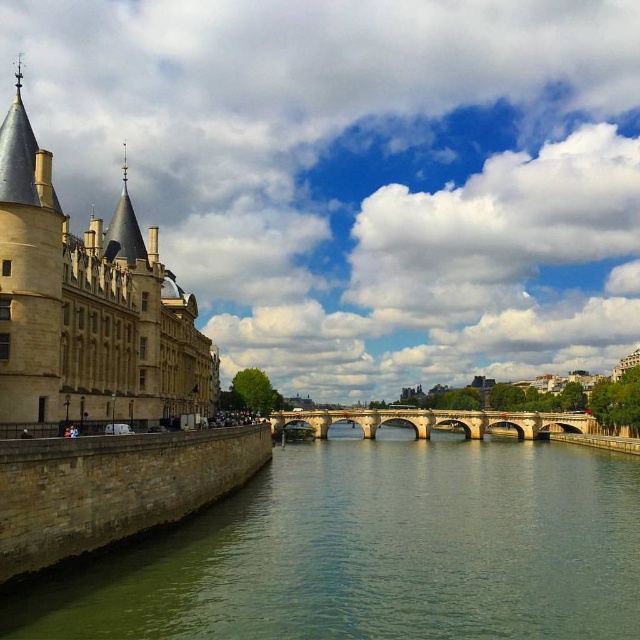
Between green stone river at center and beige stone castle at left, which one is positioned lower?

green stone river at center is lower down.

Measure the distance from green stone river at center to beige stone castle at left.

green stone river at center is 35.99 meters away from beige stone castle at left.

Measure the distance between green stone river at center and camera.

green stone river at center and camera are 56.31 meters apart.

This screenshot has height=640, width=640. I want to click on green stone river at center, so click(372, 550).

Who is taller, green stone river at center or stone bridge at center?

Standing taller between the two is green stone river at center.

Identify the location of green stone river at center. This screenshot has height=640, width=640. (372, 550).

Does beige stone castle at left have a smaller size compared to stone bridge at center?

No, beige stone castle at left is not smaller than stone bridge at center.

Which is in front, point (109, 296) or point (273, 417)?

Point (109, 296) is more forward.

Is point (72, 236) farther from camera compared to point (336, 419)?

No.

The height and width of the screenshot is (640, 640). Find the location of `beige stone castle at left`. beige stone castle at left is located at coordinates (88, 305).